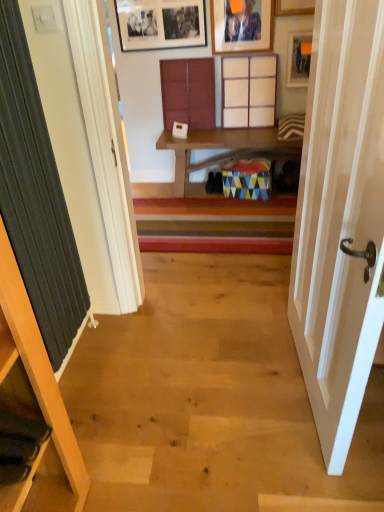
Measure the distance between wooden shelf at center and camera.

wooden shelf at center and camera are 3.18 meters apart.

I want to click on dark grey ribbed curtain at left, so click(37, 200).

What do you see at coordinates (37, 200) in the screenshot? This screenshot has width=384, height=512. I see `dark grey ribbed curtain at left` at bounding box center [37, 200].

The image size is (384, 512). Describe the element at coordinates (161, 24) in the screenshot. I see `black matte picture frame at upper center, which is the 1th picture frame in left-to-right order` at that location.

Measure the distance between wooden cabinet at lower left, positioned as the 3th cabinet in right-to-left order, and camera.

A distance of 39.21 inches exists between wooden cabinet at lower left, positioned as the 3th cabinet in right-to-left order, and camera.

How much space does matte wood cabinet at center, placed as the 3th cabinet when sorted from front to back, occupy vertically?

matte wood cabinet at center, placed as the 3th cabinet when sorted from front to back, is 21.77 inches tall.

This screenshot has width=384, height=512. Describe the element at coordinates (188, 92) in the screenshot. I see `matte wood cabinet at center, placed as the 3th cabinet when sorted from front to back` at that location.

What do you see at coordinates (241, 26) in the screenshot?
I see `matte wooden picture frame at upper center, arranged as the second picture frame when viewed from the right` at bounding box center [241, 26].

The image size is (384, 512). Describe the element at coordinates (340, 219) in the screenshot. I see `white wood door at right` at that location.

Find the location of a particular element. Image resolution: width=384 pixels, height=512 pixels. wooden shelf at center is located at coordinates (222, 152).

Is matte wooden picture frame at upper center, arranged as the second picture frame when viewed from the right, in front of or behind wooden cabinet at upper center, which appears as the first cabinet when viewed from the right, in the image?

matte wooden picture frame at upper center, arranged as the second picture frame when viewed from the right, is in front of wooden cabinet at upper center, which appears as the first cabinet when viewed from the right.

Locate an element on the screen. the 3rd picture frame in front of the wooden cabinet at upper center, acting as the 2th cabinet starting from the top, starting your count from the anchor is located at coordinates (241, 26).

Looking at this image, between matte wooden picture frame at upper center, arranged as the second picture frame when viewed from the right, and wooden cabinet at upper center, which appears as the 2th cabinet when ordered from the bottom, which one has more height?

wooden cabinet at upper center, which appears as the 2th cabinet when ordered from the bottom, is taller.

From the image's perspective, is matte wooden picture frame at upper center, arranged as the second picture frame when viewed from the right, located beneath wooden cabinet at upper center, which is the second cabinet from front to back?

No, from the image's perspective, matte wooden picture frame at upper center, arranged as the second picture frame when viewed from the right, is not below wooden cabinet at upper center, which is the second cabinet from front to back.

Considering the points (194, 117) and (39, 452), which point is in front, point (194, 117) or point (39, 452)?

Point (39, 452)

Is matte wood cabinet at center, placed as the 3th cabinet when sorted from front to back, facing towards wooden cabinet at lower left, the third cabinet in the back-to-front sequence?

Yes, matte wood cabinet at center, placed as the 3th cabinet when sorted from front to back, faces towards wooden cabinet at lower left, the third cabinet in the back-to-front sequence.

Is there a large distance between matte wood cabinet at center, the 2th cabinet in the left-to-right sequence, and wooden cabinet at lower left, the third cabinet in the back-to-front sequence?

Yes, matte wood cabinet at center, the 2th cabinet in the left-to-right sequence, is far from wooden cabinet at lower left, the third cabinet in the back-to-front sequence.

From the picture: Measure the distance from matte wood cabinet at center, placed as the 3th cabinet when sorted from front to back, to wooden cabinet at lower left, the first cabinet from the bottom.

matte wood cabinet at center, placed as the 3th cabinet when sorted from front to back, is 2.62 meters away from wooden cabinet at lower left, the first cabinet from the bottom.

Which of these two, white wood door at right or wooden cabinet at lower left, which appears as the 1th cabinet when viewed from the front, is wider?

With larger width is wooden cabinet at lower left, which appears as the 1th cabinet when viewed from the front.

From the image's perspective, is white wood door at right above or below wooden cabinet at lower left, placed as the 1th cabinet when sorted from left to right?

white wood door at right is above wooden cabinet at lower left, placed as the 1th cabinet when sorted from left to right.

From a real-world perspective, which object stands above the other?

white wood door at right is physically above.

Which point is more forward, (x=258, y=123) or (x=211, y=161)?

The point (x=258, y=123) is in front.

Locate an element on the screen. Image resolution: width=384 pixels, height=512 pixels. cabinet that is the 3rd one above the wooden shelf at center (from a real-world perspective) is located at coordinates (249, 91).

Is wooden cabinet at upper center, which is the second cabinet from front to back, taller than wooden shelf at center?

Yes, wooden cabinet at upper center, which is the second cabinet from front to back, is taller than wooden shelf at center.

Based on the photo, is wooden cabinet at upper center, which appears as the 2th cabinet when ordered from the bottom, not near wooden shelf at center?

No, wooden cabinet at upper center, which appears as the 2th cabinet when ordered from the bottom, is in close proximity to wooden shelf at center.

The height and width of the screenshot is (512, 384). In order to click on door below the dark grey ribbed curtain at left (from a real-world perspective) in this screenshot , I will do (340, 219).

Is the position of dark grey ribbed curtain at left more distant than that of white wood door at right?

Yes, it is.

Is dark grey ribbed curtain at left next to white wood door at right?

dark grey ribbed curtain at left and white wood door at right are clearly separated.

Between dark grey ribbed curtain at left and white wood door at right, which one has larger size?

white wood door at right.

Are matte wooden picture frame at upper center, the 2th picture frame when ordered from left to right, and white wood door at right making contact?

No, matte wooden picture frame at upper center, the 2th picture frame when ordered from left to right, is not in contact with white wood door at right.

Which object is further away from the camera, matte wooden picture frame at upper center, arranged as the second picture frame when viewed from the right, or white wood door at right?

matte wooden picture frame at upper center, arranged as the second picture frame when viewed from the right, is behind.

From a real-world perspective, between matte wooden picture frame at upper center, arranged as the second picture frame when viewed from the right, and white wood door at right, who is vertically higher?

matte wooden picture frame at upper center, arranged as the second picture frame when viewed from the right.

Does matte wooden picture frame at upper center, the 2th picture frame when ordered from left to right, turn towards white wood door at right?

Yes, matte wooden picture frame at upper center, the 2th picture frame when ordered from left to right, is facing white wood door at right.

Considering the positions of points (302, 39) and (201, 130), is point (302, 39) closer to camera compared to point (201, 130)?

Yes, point (302, 39) is closer to viewer.

Is matte wooden picture frame at upper right, which is the 1th picture frame in right-to-left order, spatially inside wooden shelf at center, or outside of it?

matte wooden picture frame at upper right, which is the 1th picture frame in right-to-left order, cannot be found inside wooden shelf at center.

Does matte wooden picture frame at upper right, which is the 1th picture frame in right-to-left order, have a lesser width compared to wooden shelf at center?

Correct, the width of matte wooden picture frame at upper right, which is the 1th picture frame in right-to-left order, is less than that of wooden shelf at center.

What's the angular difference between matte wooden picture frame at upper right, the third picture frame positioned from the left, and wooden shelf at center's facing directions?

matte wooden picture frame at upper right, the third picture frame positioned from the left, and wooden shelf at center are facing 0.0013 degrees away from each other.

The width and height of the screenshot is (384, 512). I want to click on the 2nd cabinet below the matte wooden picture frame at upper center, arranged as the second picture frame when viewed from the right (from the image's perspective), so click(249, 91).

This screenshot has height=512, width=384. Identify the location of cabinet that is the 2nd one when counting forward from the matte wood cabinet at center, placed as the 3th cabinet when sorted from front to back. (20, 456).

Which object lies nearer to the anchor point black matte picture frame at upper center, which is the 1th picture frame in left-to-right order, matte wood cabinet at center, which is the 2th cabinet from right to left, or wooden cabinet at upper center, which is the second cabinet from front to back?

Based on the image, matte wood cabinet at center, which is the 2th cabinet from right to left, appears to be nearer to black matte picture frame at upper center, which is the 1th picture frame in left-to-right order.

Estimate the real-world distances between objects in this image. Which object is closer to black matte picture frame at upper center, which is the 1th picture frame in left-to-right order, wooden shelf at center or wooden cabinet at upper center, acting as the 2th cabinet starting from the top?

wooden cabinet at upper center, acting as the 2th cabinet starting from the top, is closer to black matte picture frame at upper center, which is the 1th picture frame in left-to-right order.

From the image, which object appears to be farther from dark grey ribbed curtain at left, black matte picture frame at upper center, which is the 1th picture frame in left-to-right order, or matte wooden picture frame at upper right, the third picture frame positioned from the left?

The object further to dark grey ribbed curtain at left is matte wooden picture frame at upper right, the third picture frame positioned from the left.

Looking at the image, which one is located further to dark grey ribbed curtain at left, white wood door at right or wooden shelf at center?

wooden shelf at center is further to dark grey ribbed curtain at left.

Estimate the real-world distances between objects in this image. Which object is further from dark grey ribbed curtain at left, matte wood cabinet at center, placed as the 3th cabinet when sorted from front to back, or matte wooden picture frame at upper right, which is the 1th picture frame in right-to-left order?

The object further to dark grey ribbed curtain at left is matte wooden picture frame at upper right, which is the 1th picture frame in right-to-left order.

Based on their spatial positions, is matte wood cabinet at center, the 3th cabinet when ordered from bottom to top, or wooden shelf at center further from matte wooden picture frame at upper center, arranged as the second picture frame when viewed from the right?

wooden shelf at center lies further to matte wooden picture frame at upper center, arranged as the second picture frame when viewed from the right, than the other object.

From the image, which object appears to be farther from matte wooden picture frame at upper center, the 2th picture frame when ordered from left to right, white wood door at right or wooden cabinet at lower left, which is counted as the 3th cabinet, starting from the top?

Based on the image, wooden cabinet at lower left, which is counted as the 3th cabinet, starting from the top, appears to be further to matte wooden picture frame at upper center, the 2th picture frame when ordered from left to right.

Looking at the image, which one is located further to wooden cabinet at upper center, which is the second cabinet from front to back, wooden shelf at center or matte wooden picture frame at upper right, which is the 1th picture frame in right-to-left order?

Based on the image, wooden shelf at center appears to be further to wooden cabinet at upper center, which is the second cabinet from front to back.

At what (x,y) coordinates should I click in order to perform the action: click on table located between wooden cabinet at lower left, the third cabinet in the back-to-front sequence, and matte wood cabinet at center, the 2th cabinet in the left-to-right sequence, in the depth direction. Please return your answer as a coordinate pair (x, y). The width and height of the screenshot is (384, 512). Looking at the image, I should click on (222, 152).

Identify the location of curtain located between white wood door at right and black matte picture frame at upper center, which is the 1th picture frame in left-to-right order, in the depth direction. (37, 200).

Find the location of `curtain located between wooden cabinet at lower left, which appears as the 1th cabinet when viewed from the front, and matte wooden picture frame at upper right, which is the 1th picture frame in right-to-left order, in the depth direction`. curtain located between wooden cabinet at lower left, which appears as the 1th cabinet when viewed from the front, and matte wooden picture frame at upper right, which is the 1th picture frame in right-to-left order, in the depth direction is located at coordinates (37, 200).

Image resolution: width=384 pixels, height=512 pixels. I want to click on cabinet situated between matte wood cabinet at center, which is the 2th cabinet from right to left, and matte wooden picture frame at upper right, which is the 1th picture frame in right-to-left order, from left to right, so click(x=249, y=91).